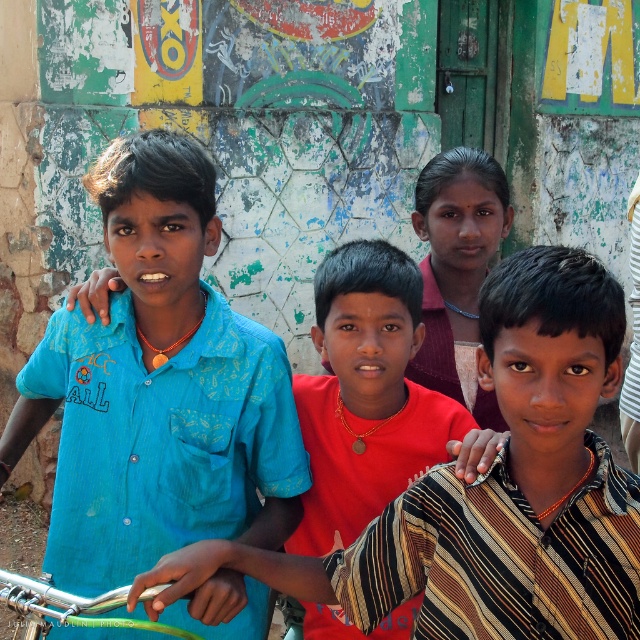
Question: Can you confirm if blue fabric shirt at left is positioned to the left of green rubber handlebars at lower left?

Choices:
 (A) yes
 (B) no

Answer: (B)

Question: Which of the following is the closest to the observer?

Choices:
 (A) (92, 621)
 (B) (419, 600)
 (C) (458, 378)
 (D) (116, 452)

Answer: (A)

Question: Does matte pink shirt at center lie behind green rubber handlebars at lower left?

Choices:
 (A) yes
 (B) no

Answer: (A)

Question: Which point is farther from the camera taking this photo?

Choices:
 (A) (148, 625)
 (B) (484, 396)

Answer: (B)

Question: Which point is closer to the camera?

Choices:
 (A) (19, 408)
 (B) (58, 596)
 (C) (497, 188)
 (D) (563, 545)

Answer: (D)

Question: In this image, where is blue cotton shirt at left located relative to red matte shirt at center?

Choices:
 (A) left
 (B) right

Answer: (A)